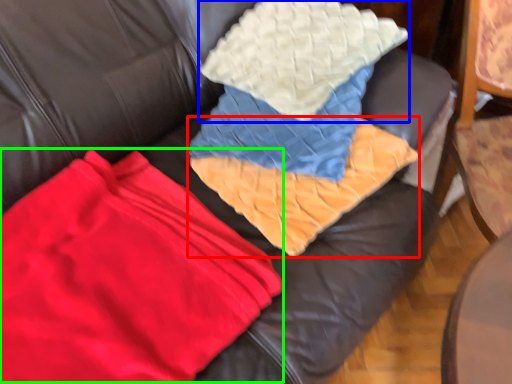
Question: Which object is the closest to the blanket (highlighted by a red box)? Choose among these: throw pillow (highlighted by a blue box) or fabric (highlighted by a green box).

Choices:
 (A) throw pillow
 (B) fabric

Answer: (A)